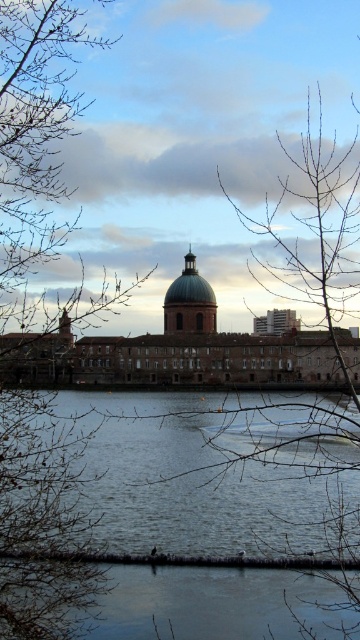
Based on the photo, can you confirm if smooth water at center is taller than bare branches at left?

No, smooth water at center is not taller than bare branches at left.

Can you confirm if smooth water at center is positioned above bare branches at left?

Incorrect, smooth water at center is not positioned above bare branches at left.

Find the location of a particular element. The image size is (360, 640). smooth water at center is located at coordinates (212, 476).